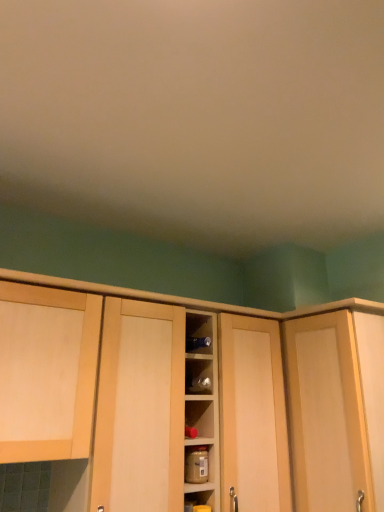
Question: Is brown matte jar at center beside light wood cabinet at left, acting as the first cabinetry starting from the left?

Choices:
 (A) no
 (B) yes

Answer: (A)

Question: Is brown matte jar at center behind light wood cabinet at left, acting as the first cabinetry starting from the left?

Choices:
 (A) yes
 (B) no

Answer: (A)

Question: Is the depth of brown matte jar at center less than that of light wood cabinet at left, acting as the first cabinetry starting from the left?

Choices:
 (A) no
 (B) yes

Answer: (A)

Question: From the image's perspective, is brown matte jar at center beneath light wood cabinet at left, the 2th cabinetry positioned from the right?

Choices:
 (A) no
 (B) yes

Answer: (B)

Question: From a real-world perspective, is brown matte jar at center located beneath light wood cabinet at left, the 2th cabinetry positioned from the right?

Choices:
 (A) yes
 (B) no

Answer: (A)

Question: From a real-world perspective, is light wood cabinet door at right positioned above or below wooden cabinet at center, the 2th cabinetry positioned from the left?

Choices:
 (A) above
 (B) below

Answer: (A)

Question: Is light wood cabinet door at right in front of or behind wooden cabinet at center, the 2th cabinetry positioned from the left, in the image?

Choices:
 (A) behind
 (B) front

Answer: (A)

Question: In terms of height, does light wood cabinet door at right look taller or shorter compared to wooden cabinet at center, marked as the 1th cabinetry in a right-to-left arrangement?

Choices:
 (A) short
 (B) tall

Answer: (A)

Question: Do you think light wood cabinet door at right is within wooden cabinet at center, marked as the 1th cabinetry in a right-to-left arrangement, or outside of it?

Choices:
 (A) inside
 (B) outside

Answer: (B)

Question: In the image, is light wood cabinet door at right on the left side or the right side of brown matte jar at center?

Choices:
 (A) left
 (B) right

Answer: (B)

Question: Relative to brown matte jar at center, is light wood cabinet door at right in front or behind?

Choices:
 (A) front
 (B) behind

Answer: (A)

Question: Is light wood cabinet door at right inside the boundaries of brown matte jar at center, or outside?

Choices:
 (A) outside
 (B) inside

Answer: (A)

Question: From a real-world perspective, is light wood cabinet door at right above or below brown matte jar at center?

Choices:
 (A) below
 (B) above

Answer: (B)

Question: Is brown matte jar at center in front of or behind light wood cabinet door at right in the image?

Choices:
 (A) behind
 (B) front

Answer: (A)

Question: Is brown matte jar at center inside the boundaries of light wood cabinet door at right, or outside?

Choices:
 (A) inside
 (B) outside

Answer: (B)